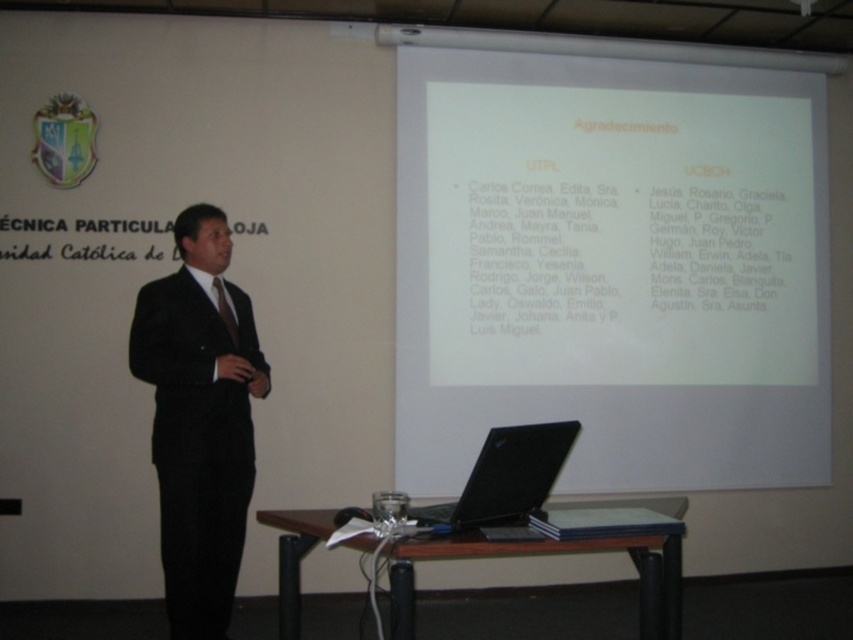
Question: Is white paper at upper center to the right of black textured suit at center from the viewer's perspective?

Choices:
 (A) no
 (B) yes

Answer: (B)

Question: Observing the image, what is the correct spatial positioning of black matte laptop at lower center in reference to matte black tie at center?

Choices:
 (A) right
 (B) left

Answer: (A)

Question: Which of the following is the farthest from the observer?

Choices:
 (A) (572, 435)
 (B) (225, 289)

Answer: (B)

Question: Which of the following is the farthest from the observer?

Choices:
 (A) matte black tie at center
 (B) white paper at upper center
 (C) black textured suit at center

Answer: (B)

Question: Considering the real-world distances, which object is closest to the matte black tie at center?

Choices:
 (A) white paper at upper center
 (B) black textured suit at center
 (C) black matte laptop at lower center

Answer: (B)

Question: Where is black textured suit at center located in relation to matte black tie at center in the image?

Choices:
 (A) right
 (B) left

Answer: (B)